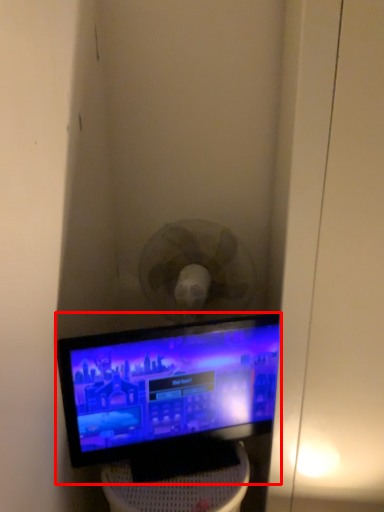
Question: From the image's perspective, what is the correct spatial positioning of computer monitor (annotated by the red box) in reference to furniture?

Choices:
 (A) above
 (B) below

Answer: (A)